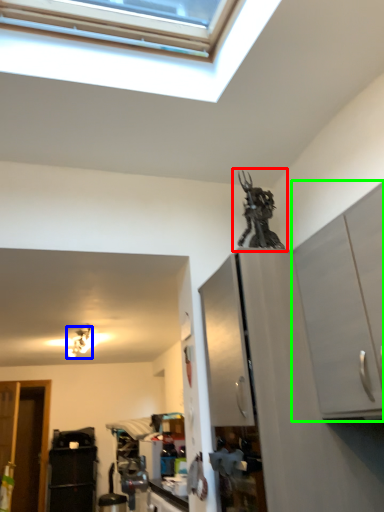
Question: Estimate the real-world distances between objects in this image. Which object is farther from sculpture (highlighted by a red box), light fixture (highlighted by a blue box) or cabinetry (highlighted by a green box)?

Choices:
 (A) light fixture
 (B) cabinetry

Answer: (A)